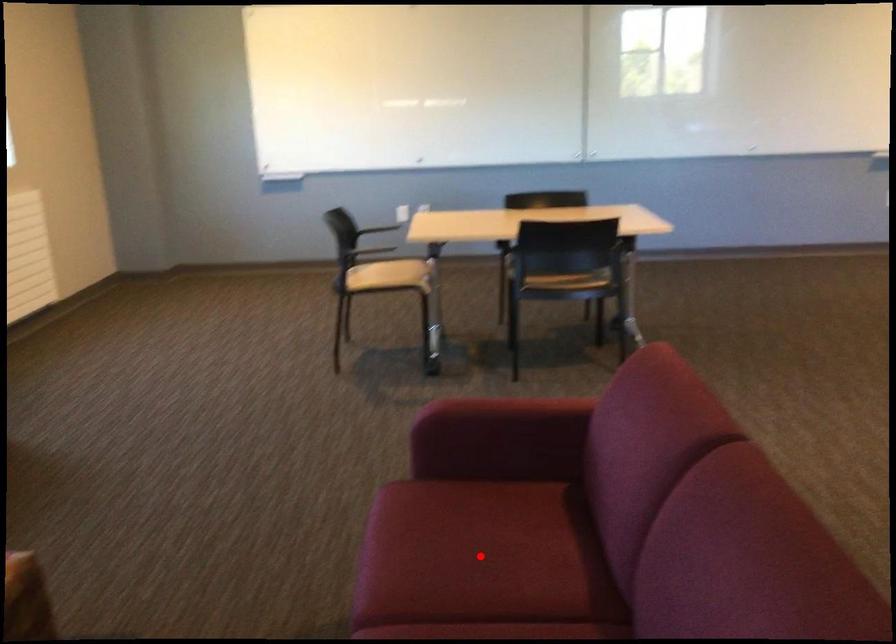
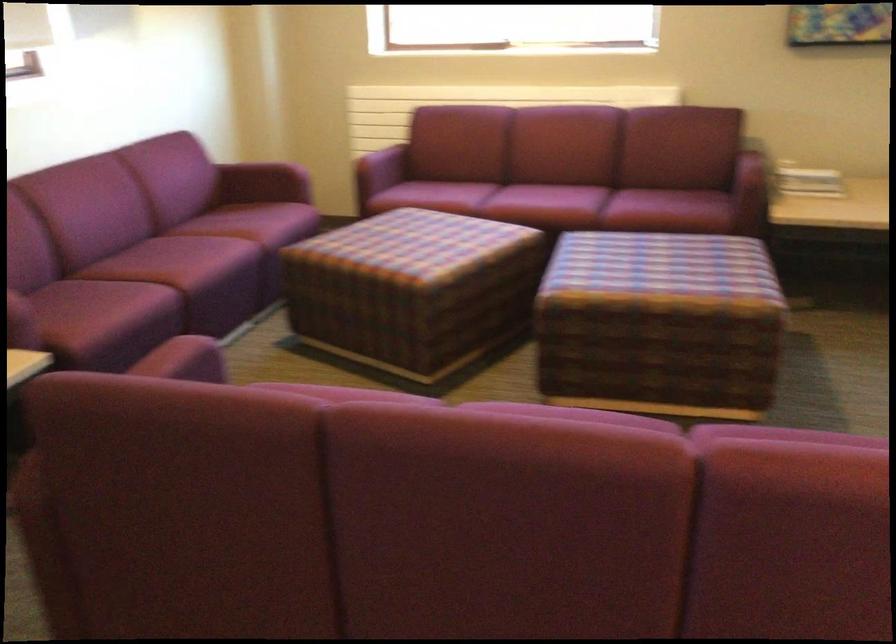
Question: I am providing you with two images of the same scene from different viewpoints. A red point is marked on the first image. At the location where the point appears in image 1, is it still visible in image 2?

Choices:
 (A) Yes
 (B) No

Answer: (B)